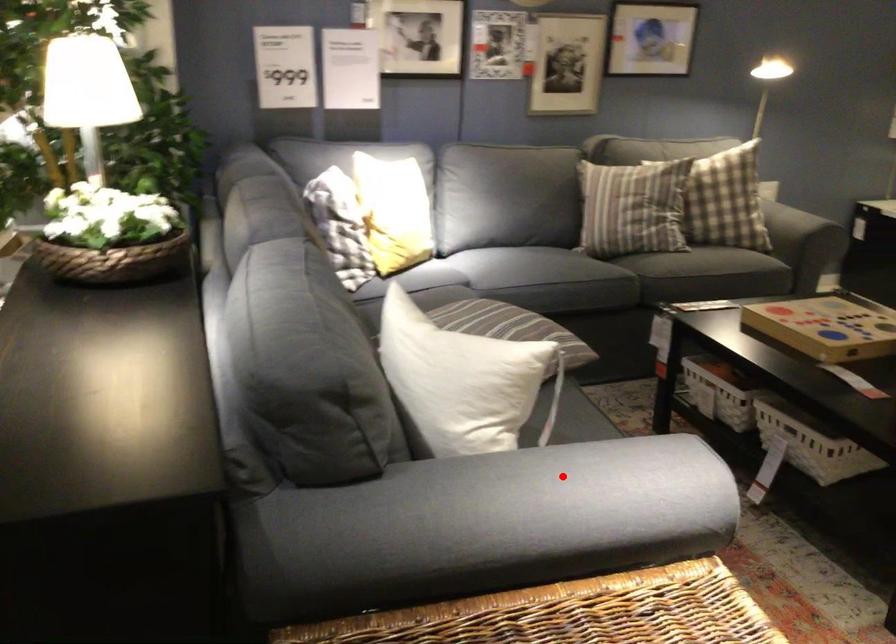
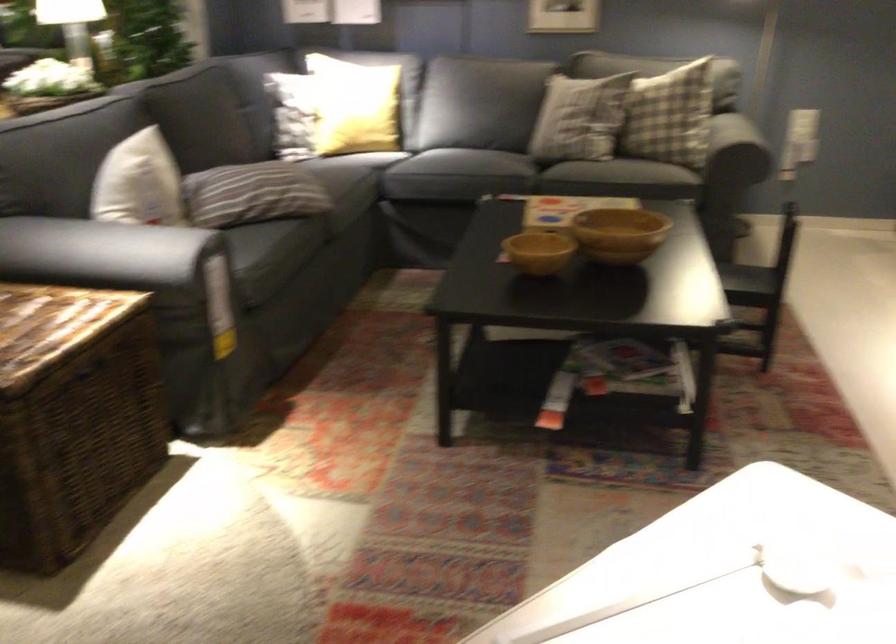
The point at the highlighted location is marked in the first image. Where is the corresponding point in the second image?

(117, 252)